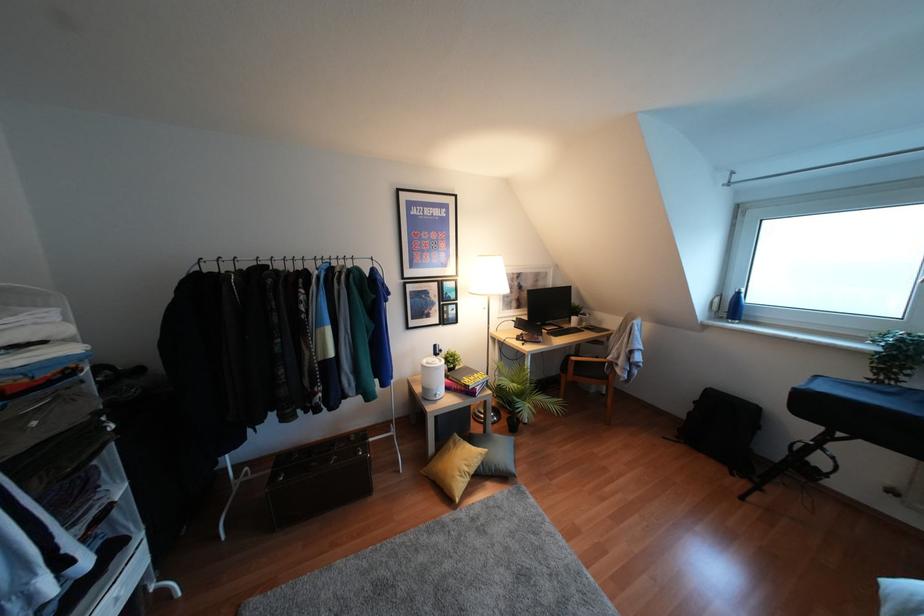
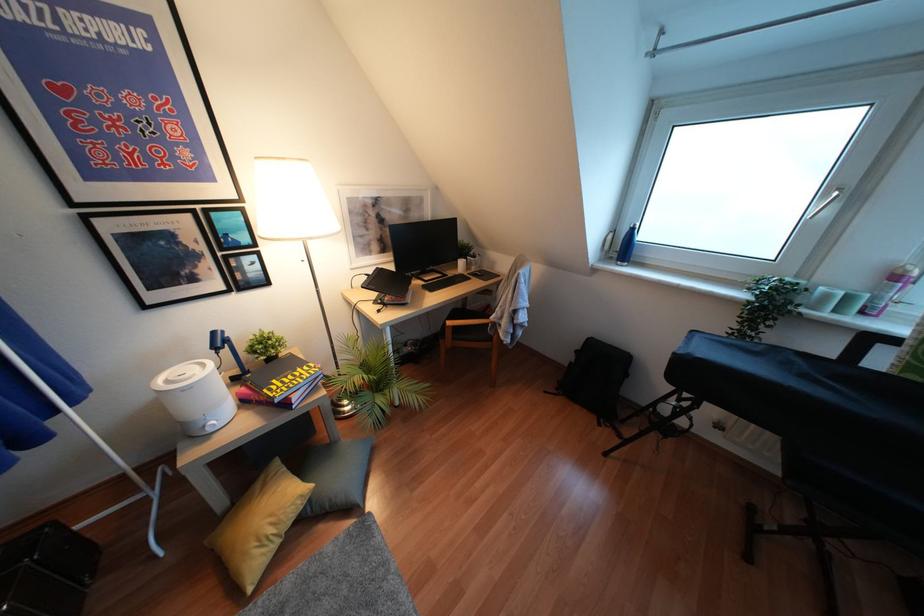
Consider the image. How did the camera likely rotate?

The camera rotated toward right-down.